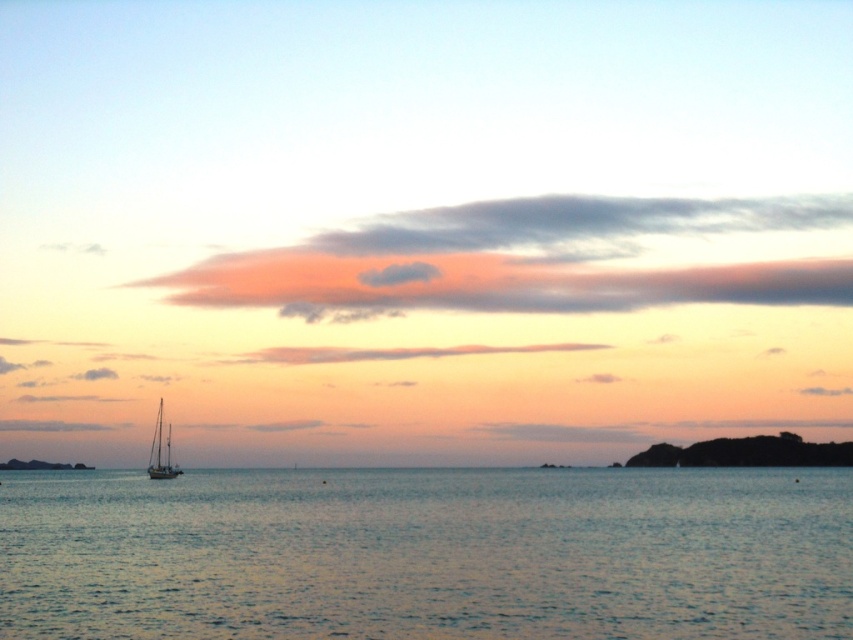
Does point (91, 573) lie behind point (170, 452)?

No, it is not.

Who is shorter, blue water at center or white matte sailboat at lower left?

With less height is blue water at center.

Which is behind, point (618, 493) or point (160, 449)?

The point (160, 449) is more distant.

This screenshot has width=853, height=640. I want to click on blue water at center, so click(428, 554).